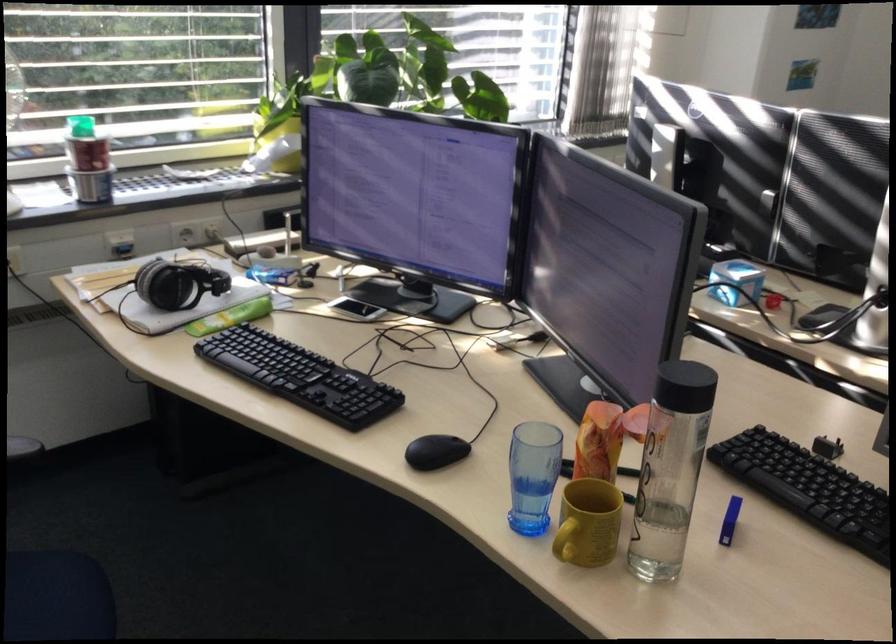
Where is `black smartphone`? The height and width of the screenshot is (644, 896). black smartphone is located at coordinates (356, 308).